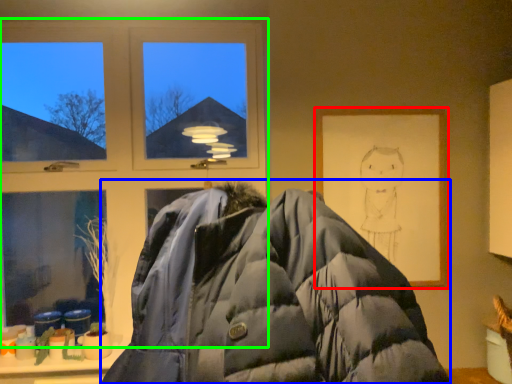
Question: Which is farther away from picture frame (highlighted by a red box)? jacket (highlighted by a blue box) or window (highlighted by a green box)?

Choices:
 (A) jacket
 (B) window

Answer: (A)